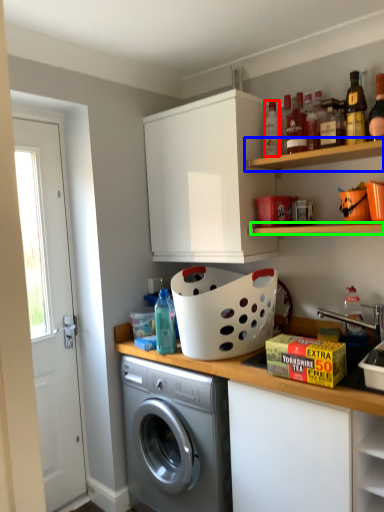
Question: Which is farther away from bottle (highlighted by a red box)? shelf (highlighted by a blue box) or shelf (highlighted by a green box)?

Choices:
 (A) shelf
 (B) shelf

Answer: (B)